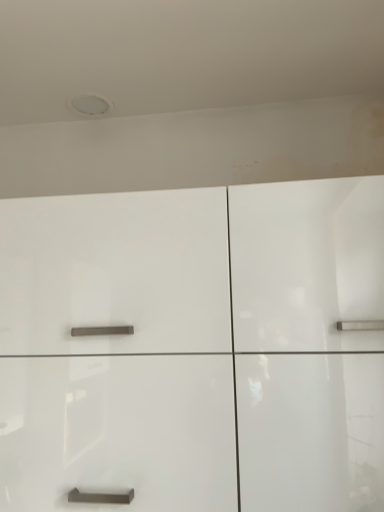
What do you see at coordinates (194, 347) in the screenshot?
I see `glossy white cabinet at center` at bounding box center [194, 347].

This screenshot has height=512, width=384. Identify the location of glossy white cabinet at center. (194, 347).

In order to click on glossy white cabinet at center in this screenshot , I will do `click(194, 347)`.